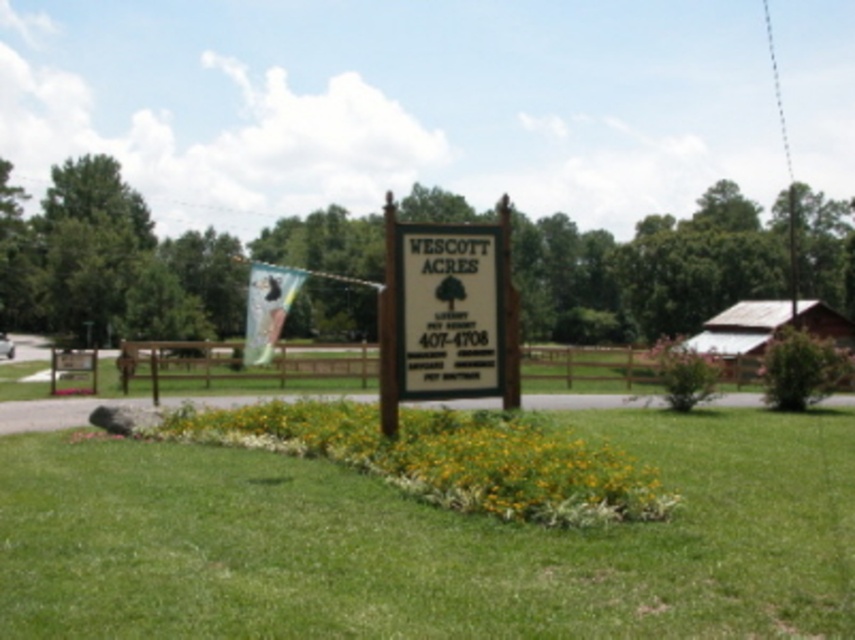
You are a landscape architect designing a new sign for Wescott Acres. The current white matte sign at center is placed on green grass at center. Based on the scene, which object occupies a larger area in the image?

The green grass at center is bigger than the white matte sign at center, so the green grass at center occupies a larger area in the image.